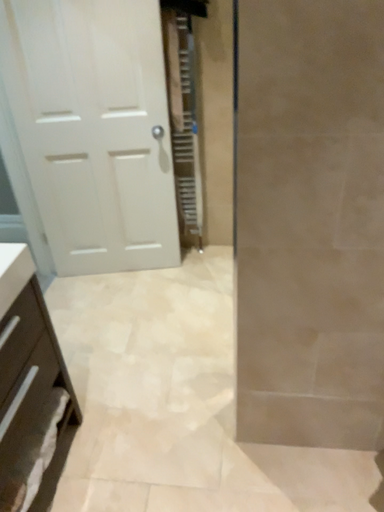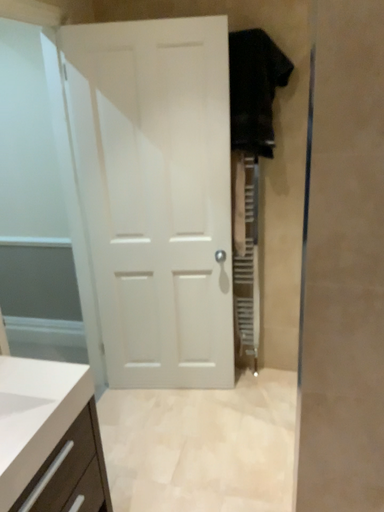
Question: How did the camera likely rotate when shooting the video?

Choices:
 (A) rotated right
 (B) rotated left

Answer: (B)